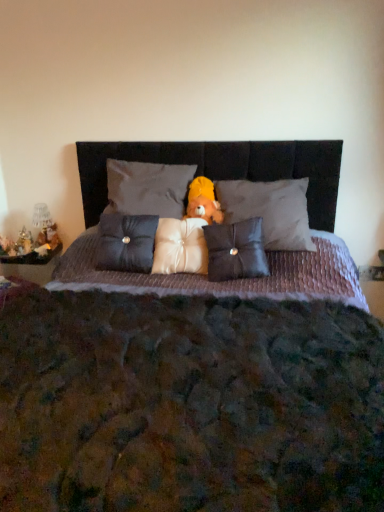
Question: Is satin white pillow at center, the third pillow from the right, bigger or smaller than satin dark blue pillow at center, the first pillow in the left-to-right sequence?

Choices:
 (A) big
 (B) small

Answer: (B)

Question: Considering the positions of satin white pillow at center, arranged as the 3th pillow when viewed from the left, and satin dark blue pillow at center, the first pillow in the left-to-right sequence, in the image, is satin white pillow at center, arranged as the 3th pillow when viewed from the left, taller or shorter than satin dark blue pillow at center, the first pillow in the left-to-right sequence,?

Choices:
 (A) short
 (B) tall

Answer: (A)

Question: Based on their relative distances, which object is nearer to the matte black pillow at center, marked as the 4th pillow in a left-to-right arrangement?

Choices:
 (A) satin dark blue pillow at center, marked as the fifth pillow in a right-to-left arrangement
 (B) textured purple quilt at center
 (C) matte gray pillow at center, the second pillow in the left-to-right sequence
 (D) metallic silver figurine at left, which appears as the 1th figurine when viewed from the left
 (E) satin white pillow at center, the third pillow from the right

Answer: (E)

Question: Which object is positioned farthest from the textured purple quilt at center?

Choices:
 (A) matte black pillow at center, marked as the 4th pillow in a left-to-right arrangement
 (B) matte gray pillow at center, marked as the 1th pillow in a right-to-left arrangement
 (C) satin white pillow at center, arranged as the 3th pillow when viewed from the left
 (D) metallic silver figurine at left, the second figurine when ordered from right to left
 (E) metallic gold figurine at left, which ranks as the second figurine in left-to-right order

Answer: (D)